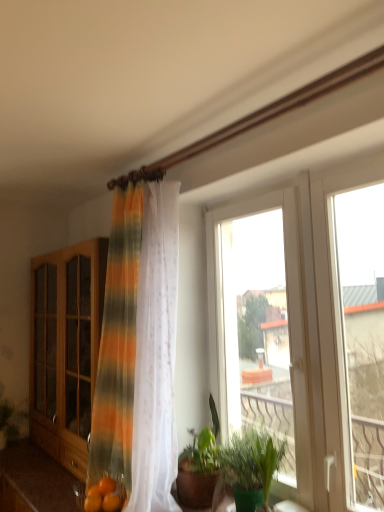
Question: From the image's perspective, is green leafy plant at center, arranged as the second houseplant when viewed from the right, located above green leafy plant at lower right, positioned as the first plant in front-to-back order?

Choices:
 (A) yes
 (B) no

Answer: (A)

Question: Does green leafy plant at center, arranged as the second houseplant when viewed from the right, appear on the left side of green leafy plant at lower right, positioned as the first plant in front-to-back order?

Choices:
 (A) yes
 (B) no

Answer: (A)

Question: Could green leafy plant at lower right, which is the 1th plant in right-to-left order, be considered to be inside green leafy plant at center, the 1th houseplant from the left?

Choices:
 (A) no
 (B) yes

Answer: (A)

Question: Is green leafy plant at center, the 1th houseplant from the left, bigger than green leafy plant at lower right, the second plant in the left-to-right sequence?

Choices:
 (A) no
 (B) yes

Answer: (B)

Question: Considering the relative sizes of green leafy plant at center, arranged as the second houseplant when viewed from the right, and green leafy plant at lower right, the second plant in the left-to-right sequence, in the image provided, is green leafy plant at center, arranged as the second houseplant when viewed from the right, thinner than green leafy plant at lower right, the second plant in the left-to-right sequence,?

Choices:
 (A) yes
 (B) no

Answer: (B)

Question: From the image's perspective, is green leafy plant at center, arranged as the second houseplant when viewed from the right, above or below orange matte citrus fruit at lower left, placed as the 1th citrus fruit when sorted from back to front?

Choices:
 (A) below
 (B) above

Answer: (B)

Question: Considering the positions of point (182, 464) and point (100, 492), is point (182, 464) closer or farther from the camera than point (100, 492)?

Choices:
 (A) farther
 (B) closer

Answer: (A)

Question: Would you say green leafy plant at center, the 1th houseplant from the left, is to the left or to the right of orange matte citrus fruit at lower left, placed as the 1th citrus fruit when sorted from back to front, in the picture?

Choices:
 (A) right
 (B) left

Answer: (A)

Question: Looking at their shapes, would you say green leafy plant at center, arranged as the second houseplant when viewed from the right, is wider or thinner than orange matte citrus fruit at lower left, positioned as the 2th citrus fruit in front-to-back order?

Choices:
 (A) wide
 (B) thin

Answer: (A)

Question: Choose the correct answer: Is white plastic window at center, positioned as the second window in right-to-left order, inside striped sheer curtain at center or outside it?

Choices:
 (A) inside
 (B) outside

Answer: (B)

Question: In terms of height, does white plastic window at center, positioned as the second window in right-to-left order, look taller or shorter compared to striped sheer curtain at center?

Choices:
 (A) short
 (B) tall

Answer: (A)

Question: From the image's perspective, is white plastic window at center, positioned as the second window in right-to-left order, positioned above or below striped sheer curtain at center?

Choices:
 (A) above
 (B) below

Answer: (B)

Question: In terms of width, does white plastic window at center, positioned as the second window in right-to-left order, look wider or thinner when compared to striped sheer curtain at center?

Choices:
 (A) wide
 (B) thin

Answer: (B)

Question: In terms of size, does orange matte citrus fruit at lower left, the 1th citrus fruit viewed from the front, appear bigger or smaller than wooden cabinet at left?

Choices:
 (A) big
 (B) small

Answer: (B)

Question: In terms of height, does orange matte citrus fruit at lower left, the 1th citrus fruit viewed from the front, look taller or shorter compared to wooden cabinet at left?

Choices:
 (A) short
 (B) tall

Answer: (A)